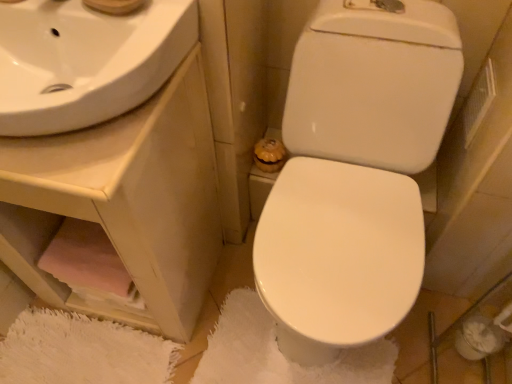
Question: Is pink fabric at lower left smaller than white glossy sink at upper left?

Choices:
 (A) no
 (B) yes

Answer: (B)

Question: Is the depth of pink fabric at lower left greater than that of white glossy sink at upper left?

Choices:
 (A) yes
 (B) no

Answer: (A)

Question: Can you confirm if pink fabric at lower left is shorter than white glossy sink at upper left?

Choices:
 (A) no
 (B) yes

Answer: (B)

Question: Does pink fabric at lower left come in front of white glossy sink at upper left?

Choices:
 (A) no
 (B) yes

Answer: (A)

Question: From a real-world perspective, is pink fabric at lower left located beneath white glossy sink at upper left?

Choices:
 (A) yes
 (B) no

Answer: (A)

Question: In terms of size, does pink fabric at lower left appear bigger or smaller than white fluffy bath mat at center?

Choices:
 (A) small
 (B) big

Answer: (B)

Question: From the image's perspective, relative to white fluffy bath mat at center, is pink fabric at lower left above or below?

Choices:
 (A) above
 (B) below

Answer: (A)

Question: Is point (101, 299) positioned closer to the camera than point (233, 306)?

Choices:
 (A) closer
 (B) farther

Answer: (A)

Question: Is pink fabric at lower left to the left or to the right of white fluffy bath mat at center in the image?

Choices:
 (A) right
 (B) left

Answer: (B)

Question: Considering the positions of white glossy sink at upper left and white glossy toilet at center in the image, is white glossy sink at upper left wider or thinner than white glossy toilet at center?

Choices:
 (A) wide
 (B) thin

Answer: (B)

Question: In terms of size, does white glossy sink at upper left appear bigger or smaller than white glossy toilet at center?

Choices:
 (A) small
 (B) big

Answer: (A)

Question: Is white glossy sink at upper left in front of or behind white glossy toilet at center in the image?

Choices:
 (A) behind
 (B) front

Answer: (A)

Question: Considering the positions of point (187, 157) and point (342, 158), is point (187, 157) closer or farther from the camera than point (342, 158)?

Choices:
 (A) farther
 (B) closer

Answer: (B)

Question: Would you say white glossy toilet at center is inside or outside white glossy sink at upper left?

Choices:
 (A) outside
 (B) inside

Answer: (A)

Question: Based on their sizes in the image, would you say white glossy toilet at center is bigger or smaller than white glossy sink at upper left?

Choices:
 (A) big
 (B) small

Answer: (A)